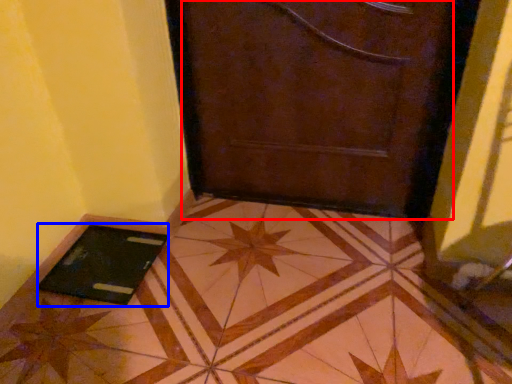
Question: Among these objects, which one is nearest to the camera, door (highlighted by a red box) or tablet computer (highlighted by a blue box)?

Choices:
 (A) door
 (B) tablet computer

Answer: (A)